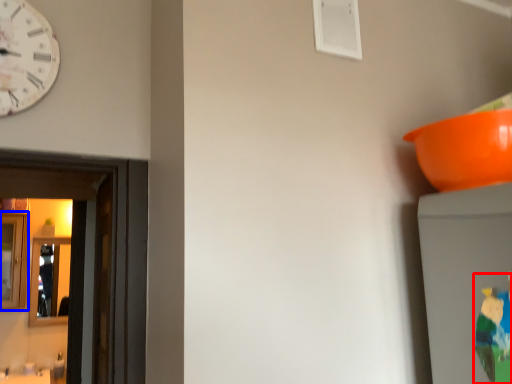
Question: Which of the following is the closest to the observer, toy (highlighted by a red box) or mirror (highlighted by a blue box)?

Choices:
 (A) toy
 (B) mirror

Answer: (A)